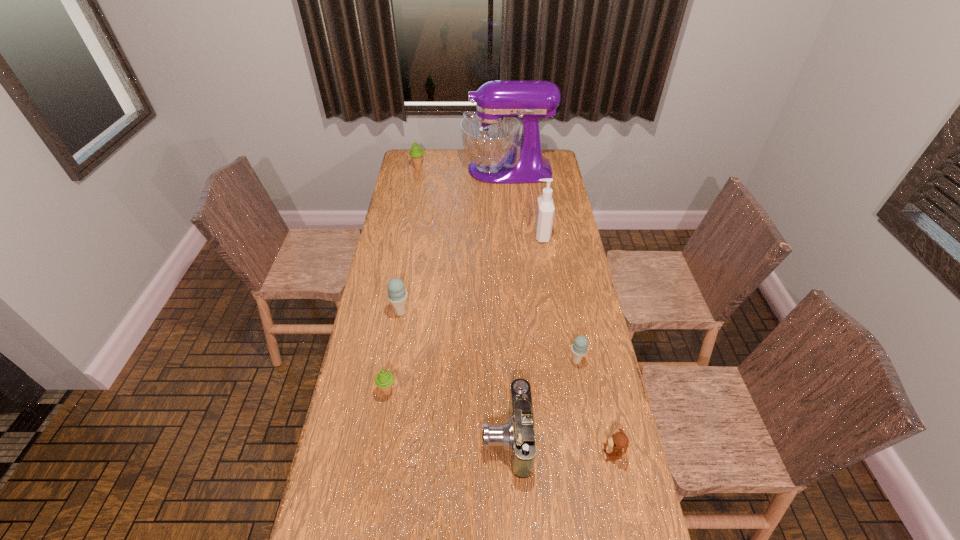
Find the location of a particular element. The height and width of the screenshot is (540, 960). vacant point located 0.190m on the face of the teddy bear is located at coordinates (537, 453).

I want to click on mixer that is at the far edge, so pyautogui.click(x=490, y=136).

Find the location of a particular element. Image resolution: width=960 pixels, height=540 pixels. icecream that is at the far edge is located at coordinates (416, 153).

The width and height of the screenshot is (960, 540). In order to click on mixer at the right edge in this screenshot , I will do `click(490, 136)`.

This screenshot has height=540, width=960. I want to click on cleansing agent that is positioned at the right edge, so click(545, 209).

Where is `ice cream that is at the right edge`? Image resolution: width=960 pixels, height=540 pixels. ice cream that is at the right edge is located at coordinates (579, 348).

At what (x,y) coordinates should I click in order to perform the action: click on teddy bear that is at the right edge. Please return your answer as a coordinate pair (x, y). Looking at the image, I should click on (618, 443).

You are a GUI agent. You are given a task and a screenshot of the screen. Output one action in this format:
    pyautogui.click(x=<x>, y=<y>)
    Task: Click on the object positioned at the far left corner
    The height and width of the screenshot is (540, 960).
    Given the screenshot: What is the action you would take?
    pyautogui.click(x=416, y=153)

I want to click on object present at the far right corner, so click(x=490, y=136).

I want to click on blank space at the left edge of the desktop, so click(x=395, y=218).